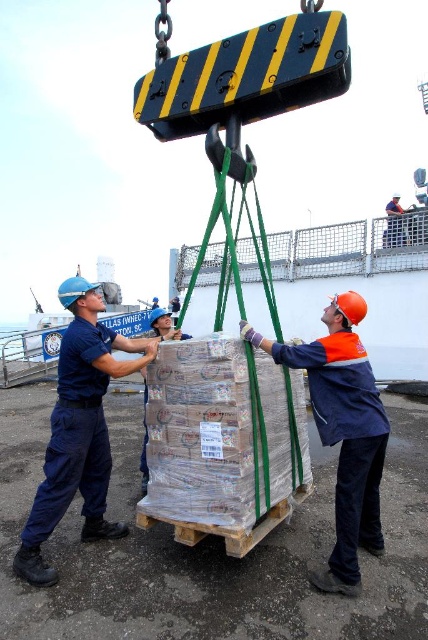
Is blue uniform at center above orange hard hat at center?

Yes, blue uniform at center is above orange hard hat at center.

The height and width of the screenshot is (640, 428). In order to click on blue uniform at center in this screenshot , I will do `click(79, 429)`.

This screenshot has height=640, width=428. In order to click on blue uniform at center in this screenshot , I will do `click(79, 429)`.

Is orange hard hat at center smaller than orange hard hat at upper center?

Indeed, orange hard hat at center has a smaller size compared to orange hard hat at upper center.

Does orange hard hat at center lie behind orange hard hat at upper center?

No, it is not.

The width and height of the screenshot is (428, 640). I want to click on orange hard hat at center, so click(x=342, y=432).

Does blue uniform at center have a smaller size compared to orange hard hat at upper center?

Yes, blue uniform at center is smaller than orange hard hat at upper center.

Is blue uniform at center wider than orange hard hat at upper center?

Incorrect, blue uniform at center's width does not surpass orange hard hat at upper center's.

Who is more distant from viewer, (x=115, y=364) or (x=392, y=216)?

Positioned behind is point (x=392, y=216).

Find the location of a particular element. blue uniform at center is located at coordinates (79, 429).